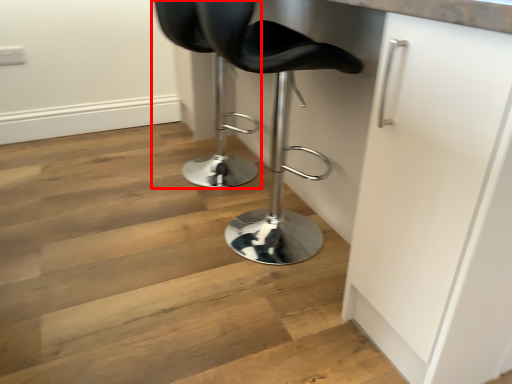
Question: From the image, what is the correct spatial relationship of chair (annotated by the red box) in relation to chair?

Choices:
 (A) right
 (B) left

Answer: (B)